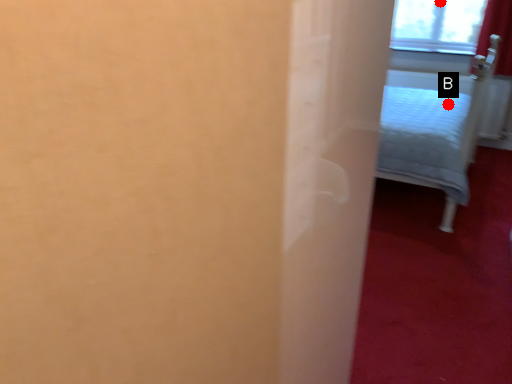
Question: Two points are circled on the image, labeled by A and B beside each circle. Which point is closer to the camera taking this photo?

Choices:
 (A) A is closer
 (B) B is closer

Answer: (B)